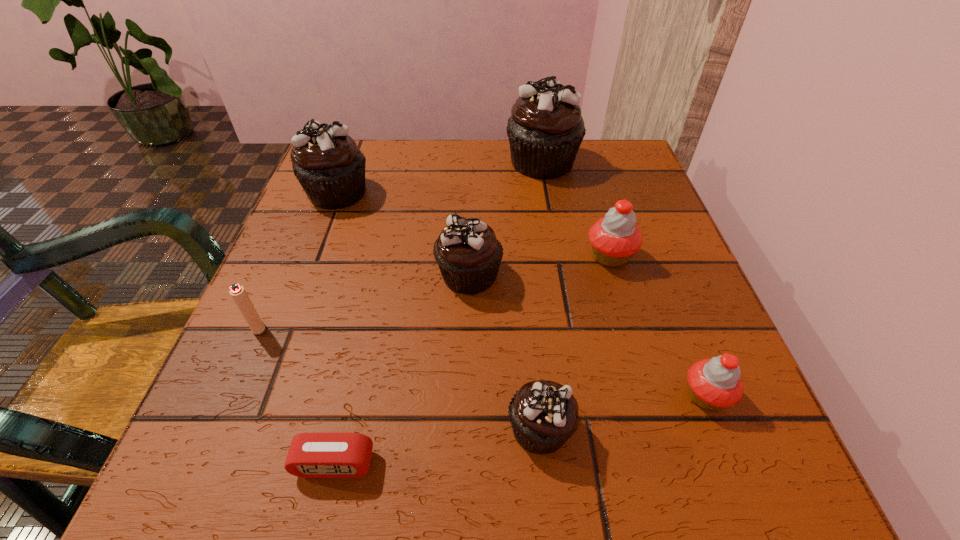
At what (x,y) coordinates should I click in order to perform the action: click on the shortest object. Please return your answer as a coordinate pair (x, y). Image resolution: width=960 pixels, height=540 pixels. Looking at the image, I should click on (311, 455).

Locate an element on the screen. The height and width of the screenshot is (540, 960). the sixth object from right to left is located at coordinates (311, 455).

Locate an element on the screen. The image size is (960, 540). free space located on the front of the tallest object is located at coordinates (560, 260).

This screenshot has width=960, height=540. In order to click on free space located 0.210m on the front of the fifth shortest cupcake in this screenshot , I will do `click(300, 291)`.

The width and height of the screenshot is (960, 540). Identify the location of free space located 0.150m on the left of the third farthest brown cupcake. (350, 275).

Find the location of `free point located 0.370m on the left of the bigger red cupcake`. free point located 0.370m on the left of the bigger red cupcake is located at coordinates (381, 256).

The width and height of the screenshot is (960, 540). Find the location of `vacant space located on the right of the red igniter`. vacant space located on the right of the red igniter is located at coordinates (324, 327).

The width and height of the screenshot is (960, 540). In order to click on free space located 0.390m on the back of the nearest brown cupcake in this screenshot , I will do `click(519, 219)`.

Find the location of a particular element. This screenshot has height=540, width=960. vacant space located on the left of the smaller red cupcake is located at coordinates (571, 396).

Locate an element on the screen. This screenshot has height=540, width=960. cupcake located in the near edge section of the desktop is located at coordinates coord(543,414).